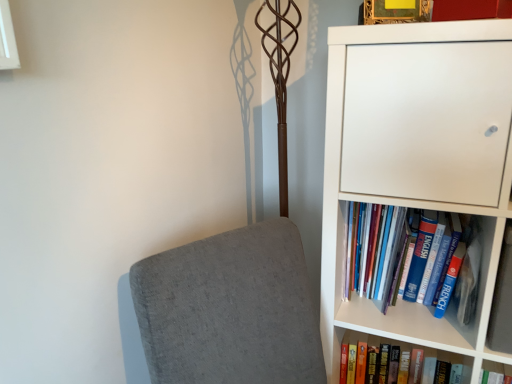
The image size is (512, 384). In order to click on hardcover book at lower right, which is the 1th book in bottom-to-top order in this screenshot , I will do `click(411, 349)`.

The height and width of the screenshot is (384, 512). Identify the location of white matte bookcase at right. (415, 160).

Is hardcover book at lower right, which is the 1th book in bottom-to-top order, to the left of blue hardcover book at right, arranged as the 2th book when ordered from the bottom, from the viewer's perspective?

Correct, you'll find hardcover book at lower right, which is the 1th book in bottom-to-top order, to the left of blue hardcover book at right, arranged as the 2th book when ordered from the bottom.

Between hardcover book at lower right, the second book viewed from the top, and blue hardcover book at right, arranged as the 2th book when ordered from the bottom, which one is positioned in front?

blue hardcover book at right, arranged as the 2th book when ordered from the bottom, is in front.

Is hardcover book at lower right, which is the 1th book in bottom-to-top order, not within blue hardcover book at right, positioned as the first book in top-to-bottom order?

Absolutely, hardcover book at lower right, which is the 1th book in bottom-to-top order, is external to blue hardcover book at right, positioned as the first book in top-to-bottom order.

From a real-world perspective, is hardcover book at lower right, the second book viewed from the top, positioned over blue hardcover book at right, positioned as the first book in top-to-bottom order, based on gravity?

No, from a real-world perspective, hardcover book at lower right, the second book viewed from the top, is not on top of blue hardcover book at right, positioned as the first book in top-to-bottom order.

Considering the sizes of objects white matte bookcase at right and blue hardcover book at right, positioned as the first book in top-to-bottom order, in the image provided, who is taller, white matte bookcase at right or blue hardcover book at right, positioned as the first book in top-to-bottom order,?

white matte bookcase at right.

Is white matte bookcase at right thinner than blue hardcover book at right, positioned as the first book in top-to-bottom order?

No, white matte bookcase at right is not thinner than blue hardcover book at right, positioned as the first book in top-to-bottom order.

Considering the positions of point (461, 332) and point (365, 220), is point (461, 332) closer or farther from the camera than point (365, 220)?

Point (461, 332) is closer to the camera than point (365, 220).

Consider the image. How many degrees apart are the facing directions of white glossy window at upper left and white matte bookcase at right?

white glossy window at upper left and white matte bookcase at right are facing 89.9 degrees away from each other.

Is there a large distance between white glossy window at upper left and white matte bookcase at right?

No, white glossy window at upper left is not far away from white matte bookcase at right.

Who is shorter, white glossy window at upper left or white matte bookcase at right?

white glossy window at upper left.

Find the location of a particular element. This screenshot has height=384, width=512. bookcase that appears behind the white glossy window at upper left is located at coordinates (415, 160).

Based on the photo, is blue hardcover book at right, arranged as the 2th book when ordered from the bottom, facing towards white glossy window at upper left?

No, blue hardcover book at right, arranged as the 2th book when ordered from the bottom, is not turned towards white glossy window at upper left.

Is blue hardcover book at right, positioned as the first book in top-to-bottom order, inside the boundaries of white glossy window at upper left, or outside?

blue hardcover book at right, positioned as the first book in top-to-bottom order, is not inside white glossy window at upper left, it's outside.

How different are the orientations of blue hardcover book at right, arranged as the 2th book when ordered from the bottom, and white glossy window at upper left in degrees?

They differ by 90.4 degrees in their facing directions.

From a real-world perspective, who is located lower, blue hardcover book at right, positioned as the first book in top-to-bottom order, or white glossy window at upper left?

In real-world perspective, blue hardcover book at right, positioned as the first book in top-to-bottom order, is lower.

Is blue hardcover book at right, arranged as the 2th book when ordered from the bottom, turned away from hardcover book at lower right, which is the 1th book in bottom-to-top order?

blue hardcover book at right, arranged as the 2th book when ordered from the bottom, does not have its back to hardcover book at lower right, which is the 1th book in bottom-to-top order.

Locate an element on the screen. book to the left of blue hardcover book at right, arranged as the 2th book when ordered from the bottom is located at coordinates (411, 349).

Looking at this image, from their relative heights in the image, would you say blue hardcover book at right, positioned as the first book in top-to-bottom order, is taller or shorter than hardcover book at lower right, the second book viewed from the top?

Considering their sizes, blue hardcover book at right, positioned as the first book in top-to-bottom order, has more height than hardcover book at lower right, the second book viewed from the top.

Considering the relative sizes of blue hardcover book at right, positioned as the first book in top-to-bottom order, and hardcover book at lower right, which is the 1th book in bottom-to-top order, in the image provided, is blue hardcover book at right, positioned as the first book in top-to-bottom order, wider than hardcover book at lower right, which is the 1th book in bottom-to-top order,?

Yes, blue hardcover book at right, positioned as the first book in top-to-bottom order, is wider than hardcover book at lower right, which is the 1th book in bottom-to-top order.

Between white matte bookcase at right and white glossy window at upper left, which one is positioned behind?

white matte bookcase at right is further from the camera.

From the picture: Does white matte bookcase at right have a greater width compared to white glossy window at upper left?

Correct, the width of white matte bookcase at right exceeds that of white glossy window at upper left.

Can you confirm if white matte bookcase at right is taller than white glossy window at upper left?

Yes.

From a real-world perspective, relative to white glossy window at upper left, is white matte bookcase at right vertically above or below?

white matte bookcase at right is below white glossy window at upper left.

Considering the relative sizes of white glossy window at upper left and hardcover book at lower right, the second book viewed from the top, in the image provided, is white glossy window at upper left bigger than hardcover book at lower right, the second book viewed from the top,?

Actually, white glossy window at upper left might be smaller than hardcover book at lower right, the second book viewed from the top.

Is white glossy window at upper left next to hardcover book at lower right, which is the 1th book in bottom-to-top order, and touching it?

No, white glossy window at upper left is not next to hardcover book at lower right, which is the 1th book in bottom-to-top order.

Is white glossy window at upper left positioned beyond the bounds of hardcover book at lower right, which is the 1th book in bottom-to-top order?

white glossy window at upper left lies outside hardcover book at lower right, which is the 1th book in bottom-to-top order,'s area.

Considering the sizes of white glossy window at upper left and hardcover book at lower right, the second book viewed from the top, in the image, is white glossy window at upper left wider or thinner than hardcover book at lower right, the second book viewed from the top,?

In the image, white glossy window at upper left appears to be more narrow than hardcover book at lower right, the second book viewed from the top.

This screenshot has height=384, width=512. What are the coordinates of `book lying above the hardcover book at lower right, which is the 1th book in bottom-to-top order (from the image's perspective)` in the screenshot? It's located at (399, 252).

Identify the location of book positioned vertically above the white matte bookcase at right (from a real-world perspective). The height and width of the screenshot is (384, 512). (399, 252).

Looking at the image, which one is located closer to blue hardcover book at right, arranged as the 2th book when ordered from the bottom, white matte bookcase at right or hardcover book at lower right, which is the 1th book in bottom-to-top order?

white matte bookcase at right lies closer to blue hardcover book at right, arranged as the 2th book when ordered from the bottom, than the other object.

Based on their spatial positions, is blue hardcover book at right, arranged as the 2th book when ordered from the bottom, or white glossy window at upper left closer to hardcover book at lower right, the second book viewed from the top?

Among the two, blue hardcover book at right, arranged as the 2th book when ordered from the bottom, is located nearer to hardcover book at lower right, the second book viewed from the top.

Considering their positions, is blue hardcover book at right, arranged as the 2th book when ordered from the bottom, positioned closer to white matte bookcase at right than hardcover book at lower right, the second book viewed from the top?

blue hardcover book at right, arranged as the 2th book when ordered from the bottom, lies closer to white matte bookcase at right than the other object.

Consider the image. Estimate the real-world distances between objects in this image. Which object is closer to white matte bookcase at right, white glossy window at upper left or blue hardcover book at right, arranged as the 2th book when ordered from the bottom?

blue hardcover book at right, arranged as the 2th book when ordered from the bottom, lies closer to white matte bookcase at right than the other object.

When comparing their distances from blue hardcover book at right, positioned as the first book in top-to-bottom order, does white matte bookcase at right or white glossy window at upper left seem further?

white glossy window at upper left lies further to blue hardcover book at right, positioned as the first book in top-to-bottom order, than the other object.

From the image, which object appears to be nearer to blue hardcover book at right, arranged as the 2th book when ordered from the bottom, white glossy window at upper left or white matte bookcase at right?

The object closer to blue hardcover book at right, arranged as the 2th book when ordered from the bottom, is white matte bookcase at right.

Estimate the real-world distances between objects in this image. Which object is further from hardcover book at lower right, which is the 1th book in bottom-to-top order, blue hardcover book at right, positioned as the first book in top-to-bottom order, or white matte bookcase at right?

white matte bookcase at right.

When comparing their distances from hardcover book at lower right, which is the 1th book in bottom-to-top order, does white glossy window at upper left or white matte bookcase at right seem closer?

white matte bookcase at right.

Locate an element on the screen. The height and width of the screenshot is (384, 512). book between white matte bookcase at right and hardcover book at lower right, which is the 1th book in bottom-to-top order, from front to back is located at coordinates (399, 252).

Where is `book between white glossy window at upper left and hardcover book at lower right, the second book viewed from the top, from front to back`? book between white glossy window at upper left and hardcover book at lower right, the second book viewed from the top, from front to back is located at coordinates (399, 252).